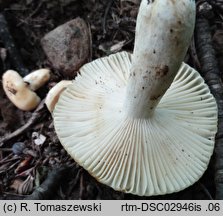
Identify the location of handle. This screenshot has height=216, width=223. (153, 86).